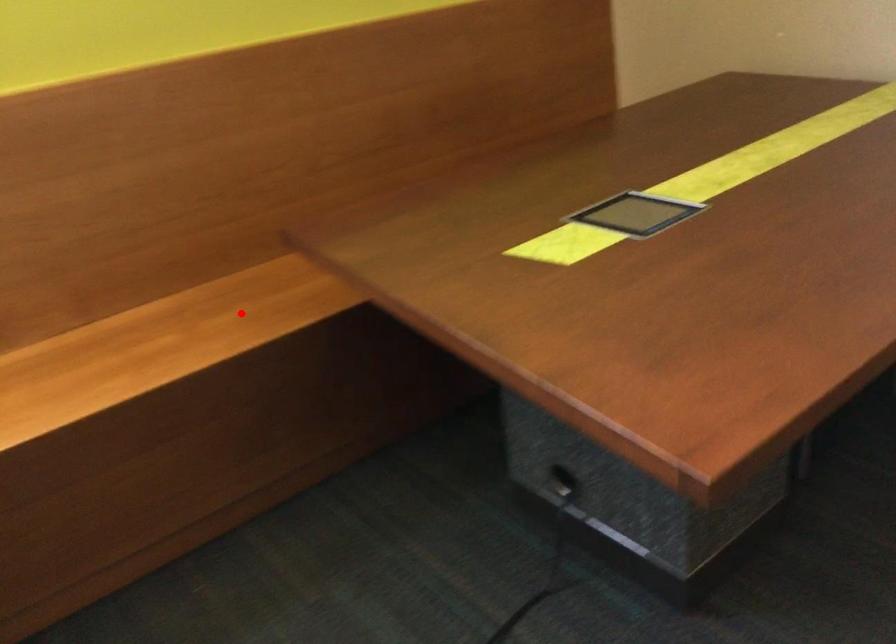
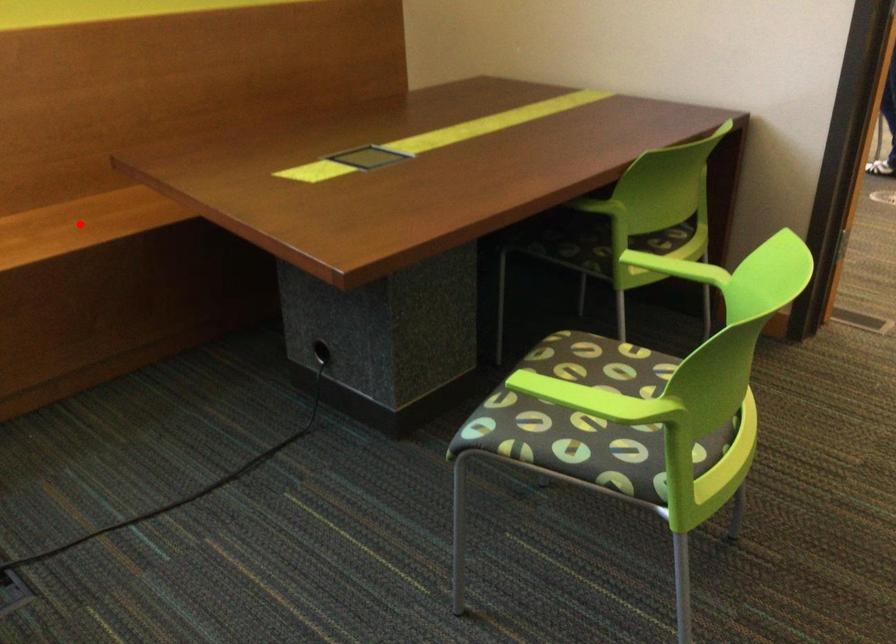
From the picture: I am providing you with two images of the same scene from different viewpoints. A red point is marked on the first image and another point is marked on the second image. Is the marked point in image1 the same physical position as the marked point in image2?

Yes